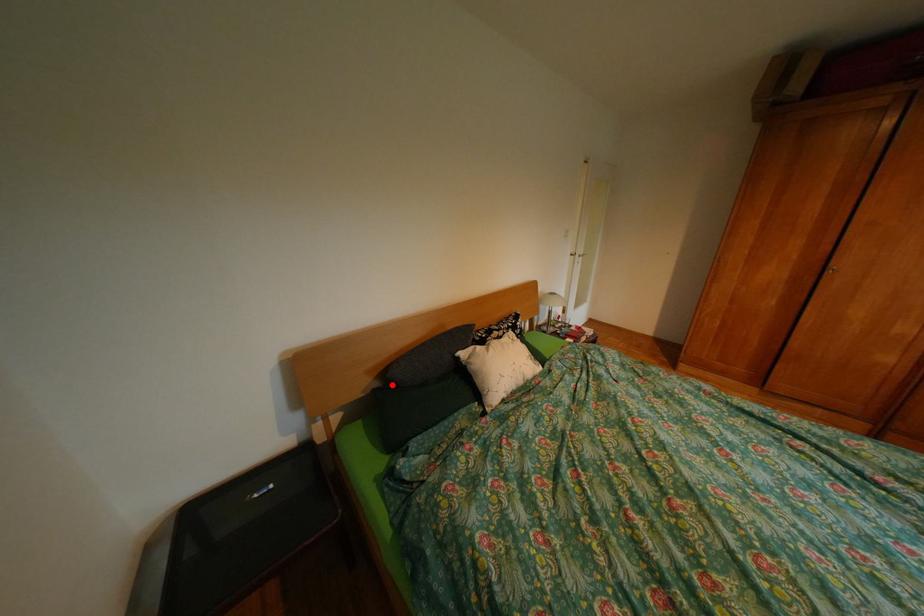
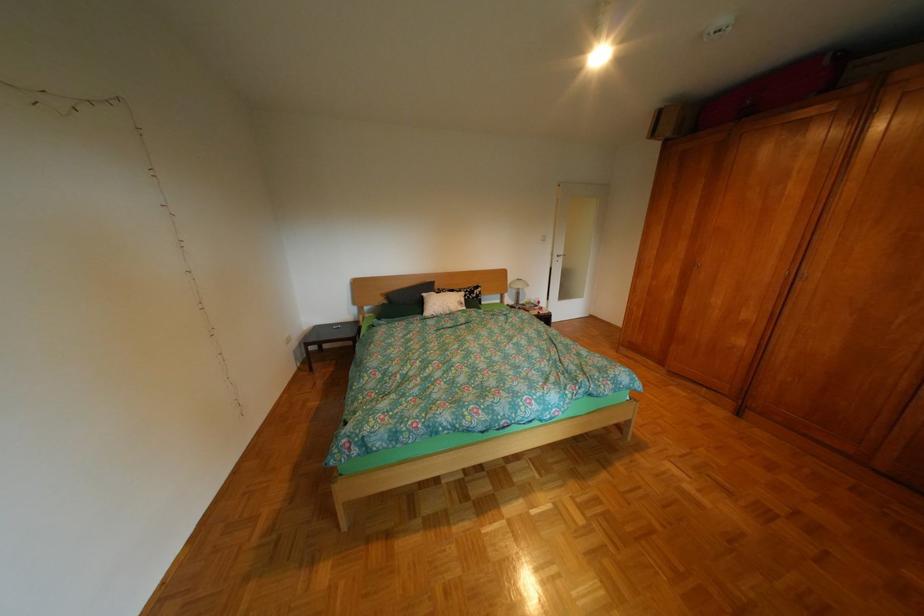
Question: A red point is marked in image1. In image2, is the corresponding 3D point closer to the camera or farther? Reply with the corresponding letter.

Choices:
 (A) The corresponding 3D point is closer.
 (B) The corresponding 3D point is farther.

Answer: (A)